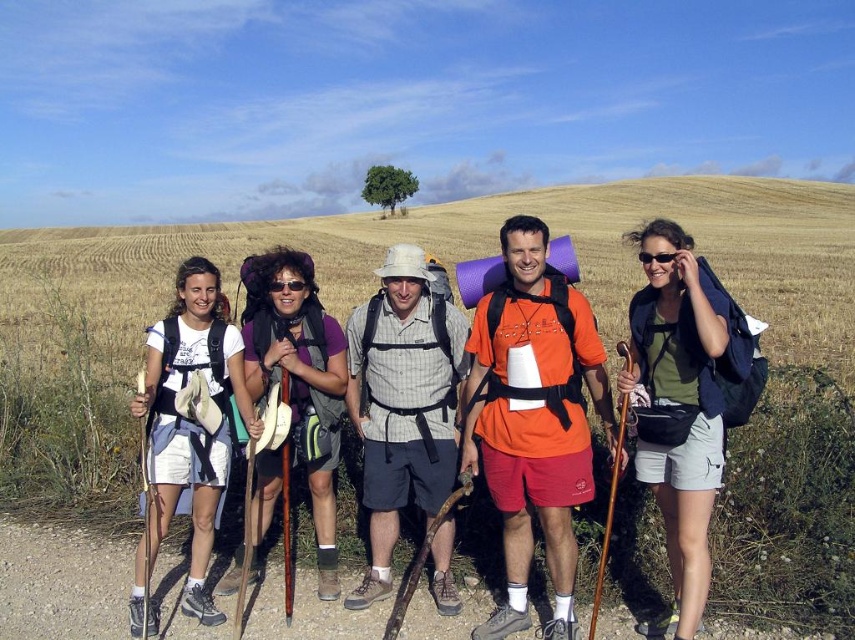
You are a hiker trying to locate your green fabric backpack in the center of the image. The image has a coordinate system where the bottom left corner is the origin point. The green fabric backpack is marked by a point at coordinates (676,408). If you are standing at the origin point, which direction should you move to reach the green fabric backpack?

You should move towards the upper right direction from the origin point to reach the green fabric backpack at coordinates (676,408).

You are a photographer planning to take a group photo of the plaid fabric shirt at center and the white fabric backpack at left. Since you want to ensure both are clearly visible, which object should you focus on to capture their details better?

The plaid fabric shirt at center has a lesser width compared to the white fabric backpack at left, so focusing on the plaid fabric shirt at center would allow you to capture its details more clearly since it is smaller and requires closer attention.

You are a photographer positioned at the camera location. You want to take a closeup shot of the white fabric backpack at left. Can you reach it without moving from your current position?

The white fabric backpack at left is 5.03 meters away from the camera, so you can take a closeup shot without moving since the distance is manageable with a zoom lens.